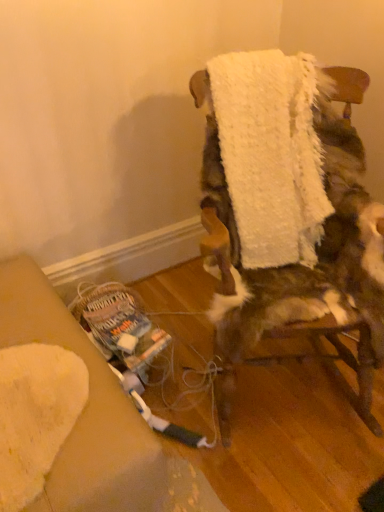
Question: From a real-world perspective, is white fluffy towel at center positioned above or below white fluffy chair at center?

Choices:
 (A) below
 (B) above

Answer: (B)

Question: In terms of size, does white fluffy towel at center appear bigger or smaller than white fluffy chair at center?

Choices:
 (A) small
 (B) big

Answer: (A)

Question: Does point (299, 158) appear closer or farther from the camera than point (274, 310)?

Choices:
 (A) closer
 (B) farther

Answer: (B)

Question: From a real-world perspective, is white fluffy chair at center above or below white fluffy towel at center?

Choices:
 (A) below
 (B) above

Answer: (A)

Question: In terms of size, does white fluffy chair at center appear bigger or smaller than white fluffy towel at center?

Choices:
 (A) big
 (B) small

Answer: (A)

Question: Relative to white fluffy towel at center, is white fluffy chair at center in front or behind?

Choices:
 (A) behind
 (B) front

Answer: (B)

Question: Is point (317, 271) closer or farther from the camera than point (294, 96)?

Choices:
 (A) farther
 (B) closer

Answer: (A)